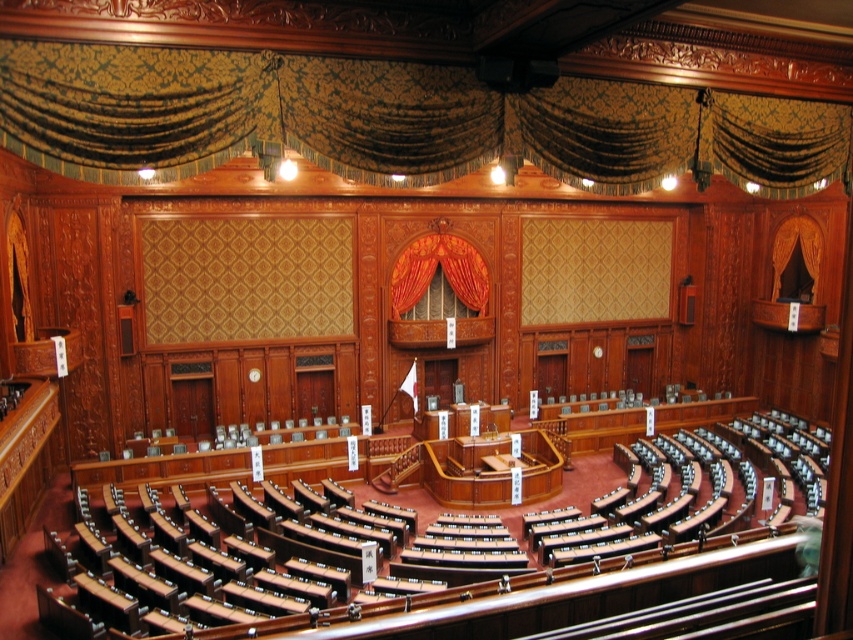
Question: Which point is closer to the camera?

Choices:
 (A) gold damask curtain at upper center
 (B) velvet orange curtain at center

Answer: (A)

Question: Which point is closer to the camera?

Choices:
 (A) (367, 116)
 (B) (407, 273)

Answer: (A)

Question: Observing the image, what is the correct spatial positioning of gold damask curtain at upper center in reference to velvet orange curtain at center?

Choices:
 (A) left
 (B) right

Answer: (B)

Question: Among these points, which one is nearest to the camera?

Choices:
 (A) pos(195,72)
 (B) pos(393,312)

Answer: (A)

Question: Can you confirm if gold damask curtain at upper center is positioned to the right of velvet orange curtain at center?

Choices:
 (A) no
 (B) yes

Answer: (B)

Question: Where is gold damask curtain at upper center located in relation to velvet orange curtain at center in the image?

Choices:
 (A) above
 (B) below

Answer: (A)